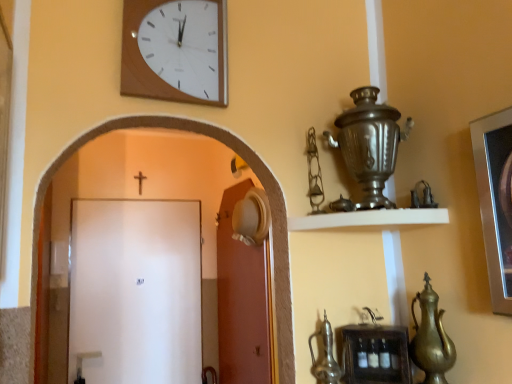
Question: From a real-world perspective, does woodenclock at upper center stand above black wooden crucifix at upper center?

Choices:
 (A) no
 (B) yes

Answer: (B)

Question: Is woodenclock at upper center at the right side of black wooden crucifix at upper center?

Choices:
 (A) yes
 (B) no

Answer: (A)

Question: Could you tell me if woodenclock at upper center is facing black wooden crucifix at upper center?

Choices:
 (A) yes
 (B) no

Answer: (B)

Question: Considering the relative sizes of woodenclock at upper center and black wooden crucifix at upper center in the image provided, is woodenclock at upper center shorter than black wooden crucifix at upper center?

Choices:
 (A) no
 (B) yes

Answer: (A)

Question: From the image's perspective, is woodenclock at upper center beneath black wooden crucifix at upper center?

Choices:
 (A) yes
 (B) no

Answer: (B)

Question: Is woodenclock at upper center not inside black wooden crucifix at upper center?

Choices:
 (A) no
 (B) yes

Answer: (B)

Question: Considering the relative positions of shiny silver samovar at upper right and white matte door at center, which ranks as the second door in right-to-left order, in the image provided, is shiny silver samovar at upper right to the right of white matte door at center, which ranks as the second door in right-to-left order, from the viewer's perspective?

Choices:
 (A) no
 (B) yes

Answer: (B)

Question: Can you confirm if shiny silver samovar at upper right is taller than white matte door at center, which ranks as the second door in right-to-left order?

Choices:
 (A) no
 (B) yes

Answer: (A)

Question: Is shiny silver samovar at upper right in contact with white matte door at center, the 1th door positioned from the left?

Choices:
 (A) no
 (B) yes

Answer: (A)

Question: Can you confirm if shiny silver samovar at upper right is wider than white matte door at center, which ranks as the second door in right-to-left order?

Choices:
 (A) yes
 (B) no

Answer: (A)

Question: From a real-world perspective, is shiny silver samovar at upper right on white matte door at center, which ranks as the second door in right-to-left order?

Choices:
 (A) no
 (B) yes

Answer: (B)

Question: Is shiny silver samovar at upper right positioned in front of white matte door at center, the 1th door positioned from the left?

Choices:
 (A) no
 (B) yes

Answer: (B)

Question: Is gold metallic teapot at lower right, marked as the first tea pot in a right-to-left arrangement, a part of black wooden crucifix at upper center?

Choices:
 (A) yes
 (B) no

Answer: (B)